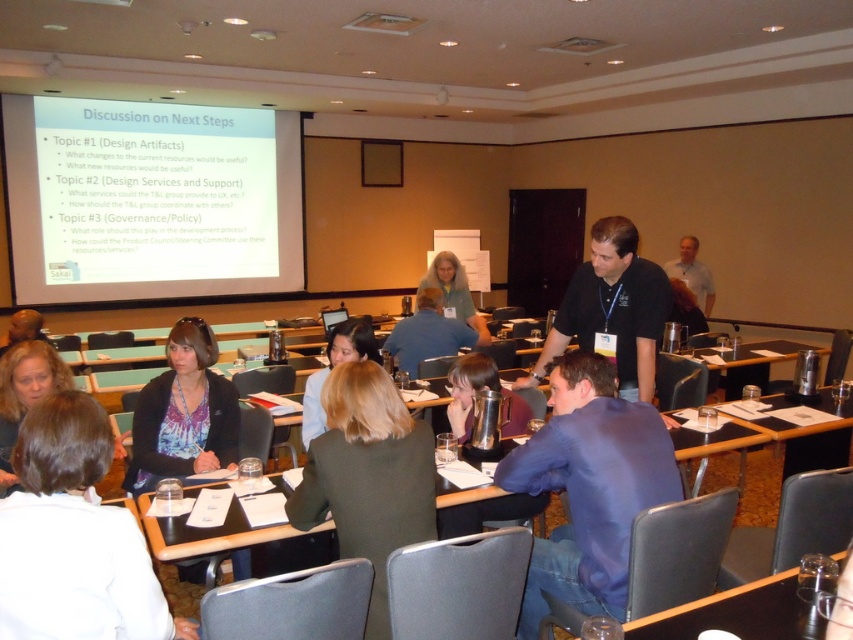
Question: Which point is closer to the camera?

Choices:
 (A) dark brown hair at center
 (B) blonde hair at center
 (C) green fabric jacket at center

Answer: (A)

Question: Which point is farther from the camera taking this photo?

Choices:
 (A) pyautogui.click(x=310, y=448)
 (B) pyautogui.click(x=419, y=310)
 (C) pyautogui.click(x=360, y=332)

Answer: (B)

Question: Which point is closer to the camera?

Choices:
 (A) black shirt at center
 (B) blonde hair at lower left
 (C) dark brown hair at center
 (D) green fabric jacket at center

Answer: (C)

Question: Does metallic silver thermos at center come behind wooden table at lower right?

Choices:
 (A) yes
 (B) no

Answer: (A)

Question: Can you confirm if white matte projector screen at upper left is positioned to the left of green fabric jacket at center?

Choices:
 (A) yes
 (B) no

Answer: (A)

Question: Is matte black jacket at center bigger than metallic silver thermos at center?

Choices:
 (A) no
 (B) yes

Answer: (B)